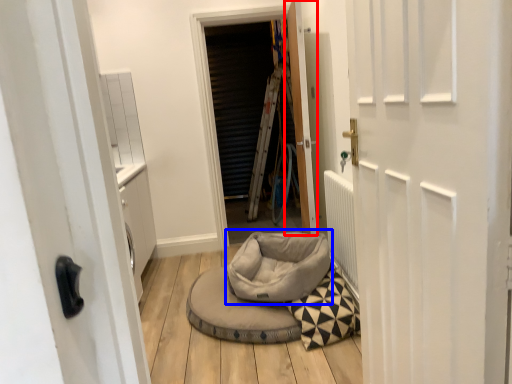
Question: Which point is further to the camera, door (highlighted by a red box) or bean bag chair (highlighted by a blue box)?

Choices:
 (A) door
 (B) bean bag chair

Answer: (A)